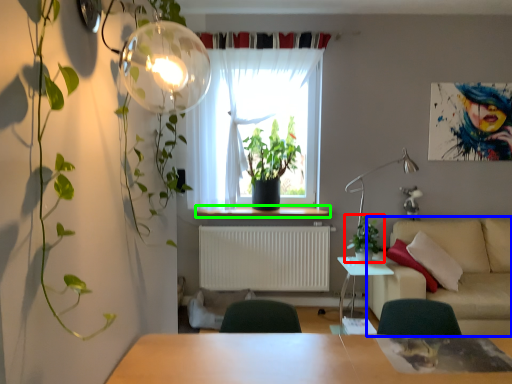
Question: Which is nearer to the houseplant (highlighted by a red box)? studio couch (highlighted by a blue box) or window sill (highlighted by a green box).

Choices:
 (A) studio couch
 (B) window sill

Answer: (A)